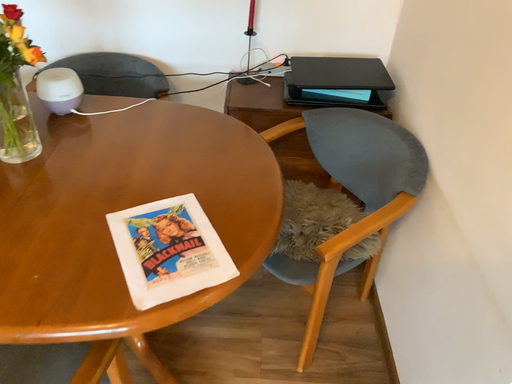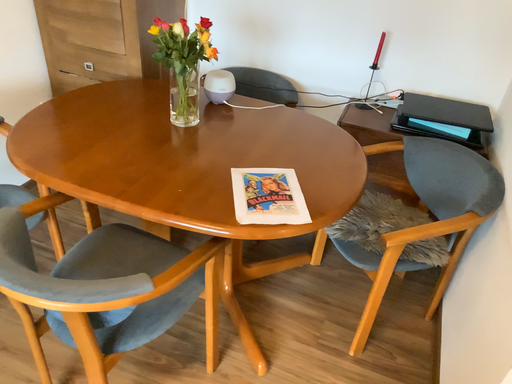
Question: Which way did the camera rotate in the video?

Choices:
 (A) rotated right
 (B) rotated left

Answer: (B)